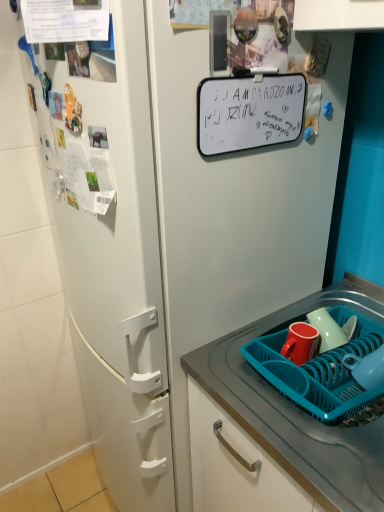
Question: Considering the relative sizes of blue plastic basket at lower right and matte red mug at lower right in the image provided, is blue plastic basket at lower right thinner than matte red mug at lower right?

Choices:
 (A) no
 (B) yes

Answer: (A)

Question: Is blue plastic basket at lower right located outside matte red mug at lower right?

Choices:
 (A) no
 (B) yes

Answer: (B)

Question: Are blue plastic basket at lower right and matte red mug at lower right far apart?

Choices:
 (A) yes
 (B) no

Answer: (B)

Question: Is blue plastic basket at lower right further to camera compared to matte red mug at lower right?

Choices:
 (A) yes
 (B) no

Answer: (B)

Question: Is blue plastic basket at lower right wider than matte red mug at lower right?

Choices:
 (A) yes
 (B) no

Answer: (A)

Question: In the image, is matte red mug at lower right positioned in front of or behind blue plastic basket at lower right?

Choices:
 (A) behind
 (B) front

Answer: (A)

Question: From the image's perspective, is matte red mug at lower right above or below blue plastic basket at lower right?

Choices:
 (A) above
 (B) below

Answer: (A)

Question: Is matte red mug at lower right wider or thinner than blue plastic basket at lower right?

Choices:
 (A) thin
 (B) wide

Answer: (A)

Question: Based on their positions, is matte red mug at lower right located to the left or right of blue plastic basket at lower right?

Choices:
 (A) right
 (B) left

Answer: (B)

Question: In terms of size, does teal plastic tray at lower right appear bigger or smaller than glossy ceramic mug at lower right?

Choices:
 (A) small
 (B) big

Answer: (B)

Question: In terms of height, does teal plastic tray at lower right look taller or shorter compared to glossy ceramic mug at lower right?

Choices:
 (A) short
 (B) tall

Answer: (B)

Question: From a real-world perspective, is teal plastic tray at lower right positioned above or below glossy ceramic mug at lower right?

Choices:
 (A) above
 (B) below

Answer: (B)

Question: Considering their positions, is teal plastic tray at lower right located in front of or behind glossy ceramic mug at lower right?

Choices:
 (A) behind
 (B) front

Answer: (B)

Question: From the image's perspective, is glossy ceramic mug at lower right located above or below teal plastic tray at lower right?

Choices:
 (A) above
 (B) below

Answer: (A)

Question: Does point (324, 335) appear closer or farther from the camera than point (258, 416)?

Choices:
 (A) closer
 (B) farther

Answer: (B)